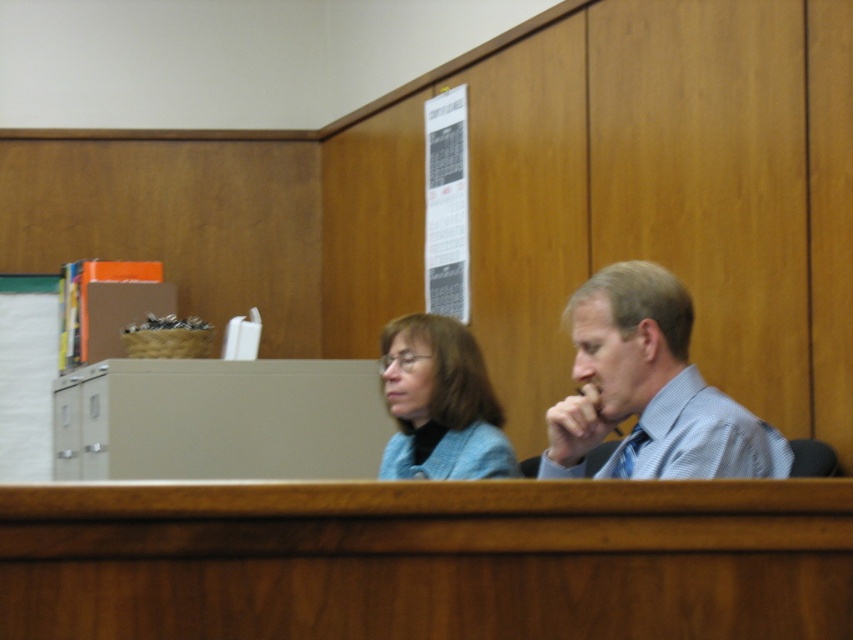
Can you confirm if wooden table at center is smaller than blue fabric jacket at center?

Correct, wooden table at center occupies less space than blue fabric jacket at center.

Does wooden table at center have a greater height compared to blue fabric jacket at center?

No.

Find the location of a particular element. This screenshot has height=640, width=853. wooden table at center is located at coordinates (427, 561).

How much distance is there between wooden table at center and blue striped shirt at right?

The distance of wooden table at center from blue striped shirt at right is 3.35 feet.

Who is more distant from viewer, (x=192, y=604) or (x=618, y=392)?

The point (x=618, y=392) is behind.

In order to click on wooden table at center in this screenshot , I will do `click(427, 561)`.

Between point (614, 305) and point (460, 333), which one is positioned in front?

Point (614, 305)

Does blue striped shirt at right have a lesser width compared to blue fabric jacket at center?

No.

Is point (660, 369) less distant than point (433, 348)?

Yes, point (660, 369) is in front of point (433, 348).

Find the location of `blue striped shirt at right`. blue striped shirt at right is located at coordinates (648, 388).